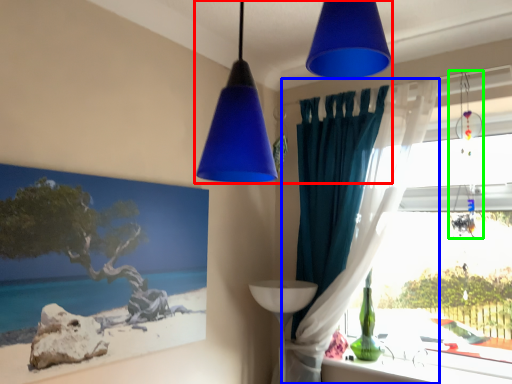
Question: Estimate the real-world distances between objects in this image. Which object is farther from lamp (highlighted by a red box), curtain (highlighted by a blue box) or lamp (highlighted by a green box)?

Choices:
 (A) curtain
 (B) lamp

Answer: (B)